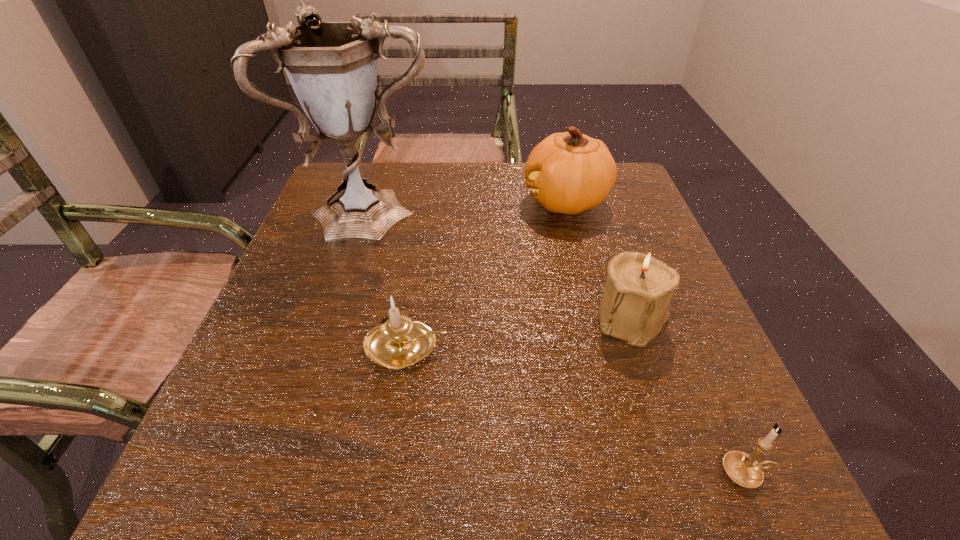
Locate an element on the screen. trophy cup is located at coordinates (332, 66).

Find the location of a particular element. The width and height of the screenshot is (960, 540). the second tallest object is located at coordinates (569, 172).

Locate an element on the screen. The height and width of the screenshot is (540, 960). the tallest candle holder is located at coordinates (634, 307).

You are a GUI agent. You are given a task and a screenshot of the screen. Output one action in this format:
    pyautogui.click(x=<x>, y=<y>)
    Task: Click on the leftmost candle holder
    This screenshot has height=540, width=960.
    Given the screenshot: What is the action you would take?
    pyautogui.click(x=398, y=342)

Find the location of a particular element. The width and height of the screenshot is (960, 540). the nearest candle holder is located at coordinates (743, 469).

The image size is (960, 540). Find the location of `free location located on the front of the tallest object`. free location located on the front of the tallest object is located at coordinates (322, 391).

Identify the location of vacant position located 0.350m on the front face of the pumpkin. This screenshot has width=960, height=540. (379, 202).

What are the coordinates of `free point located 0.300m on the front face of the pumpkin` in the screenshot? It's located at (400, 202).

Find the location of `free point located 0.180m on the front face of the pumpkin`. free point located 0.180m on the front face of the pumpkin is located at coordinates (448, 202).

Locate an element on the screen. vacant space positioned 0.230m on the back of the third shortest object is located at coordinates (601, 224).